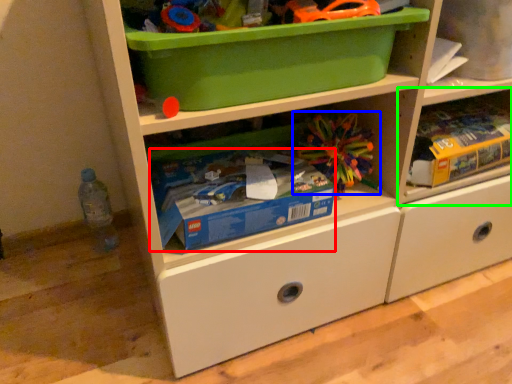
Question: Estimate the real-world distances between objects in this image. Which object is closer to storage box (highlighted by a red box), toy (highlighted by a blue box) or shelf (highlighted by a green box)?

Choices:
 (A) toy
 (B) shelf

Answer: (A)